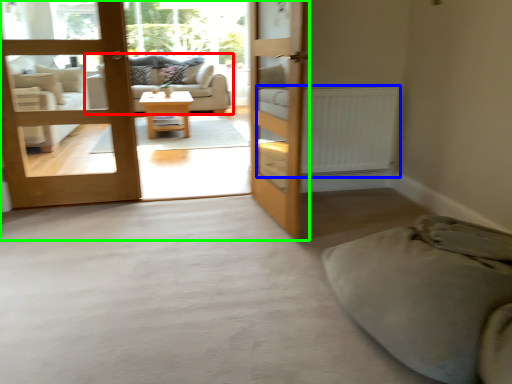
Question: Which object is positioned closest to studio couch (highlighted by a red box)? Select from radiator (highlighted by a blue box) and bunk bed (highlighted by a green box).

Choices:
 (A) radiator
 (B) bunk bed

Answer: (B)